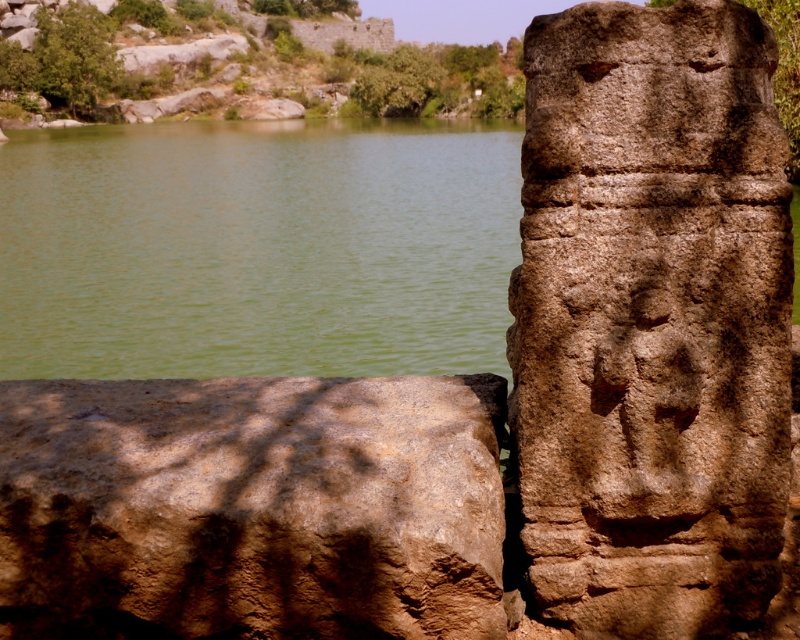
You are standing in the scene and want to place a small flag at the closest point to you between point (x=310, y=534) and point (x=220, y=353). Which point should you choose?

Point (x=310, y=534) is closer to the viewer than point (x=220, y=353), so you should choose point (x=310, y=534) to place the flag.

You are standing at the point marked as point (308, 467). There is a stone slab on the left and a taller stone structure on the right. Can you walk directly between them without any obstacles?

Yes, since they are 3.13 meters apart, there is enough space to walk directly between them without any obstacles.